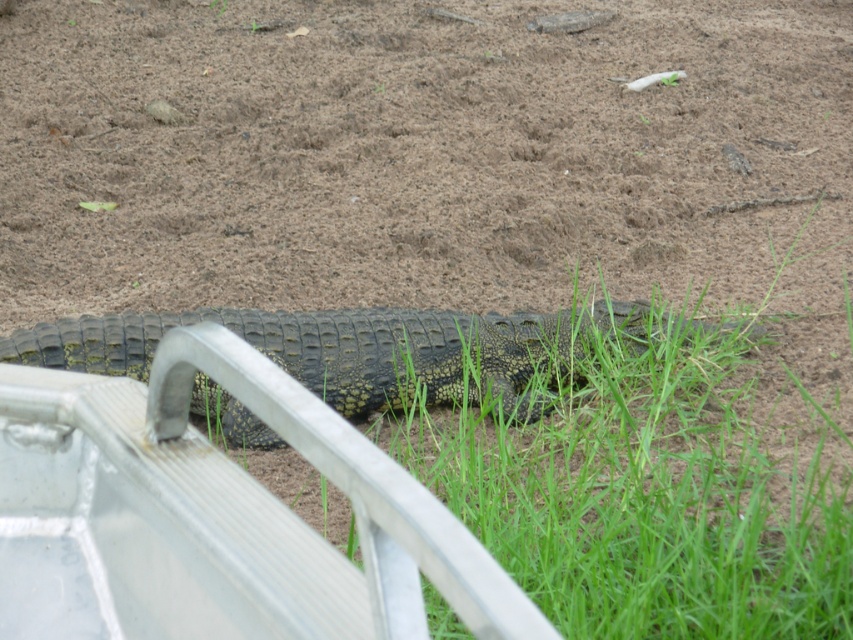
Question: Does silver metallic rail at lower left appear on the right side of green grass at center?

Choices:
 (A) yes
 (B) no

Answer: (B)

Question: Is silver metallic rail at lower left positioned at the back of green grass at center?

Choices:
 (A) no
 (B) yes

Answer: (A)

Question: Which point is farther to the camera?

Choices:
 (A) (343, 388)
 (B) (798, 380)

Answer: (A)

Question: Is silver metallic rail at lower left behind greenish-brown scaly crocodile at center?

Choices:
 (A) no
 (B) yes

Answer: (A)

Question: Which point is closer to the camera?

Choices:
 (A) (541, 408)
 (B) (109, 595)
 (C) (523, 499)

Answer: (B)

Question: Estimate the real-world distances between objects in this image. Which object is farther from the greenish-brown scaly crocodile at center?

Choices:
 (A) green grass at center
 (B) silver metallic rail at lower left

Answer: (B)